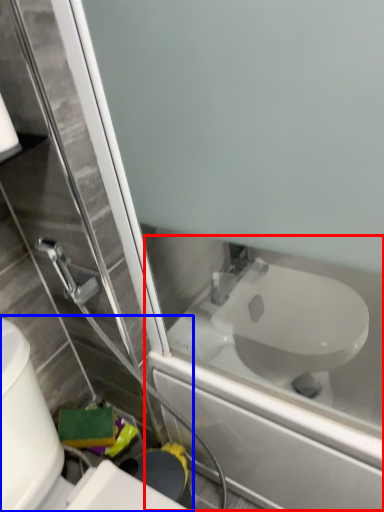
Question: Which object appears closest to the camera in this image, bath (highlighted by a red box) or toilet (highlighted by a blue box)?

Choices:
 (A) bath
 (B) toilet

Answer: (B)